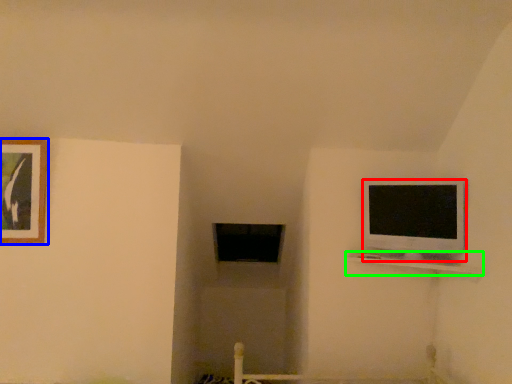
Question: Which is farther away from television (highlighted by a red box)? picture frame (highlighted by a blue box) or shelf (highlighted by a green box)?

Choices:
 (A) picture frame
 (B) shelf

Answer: (A)